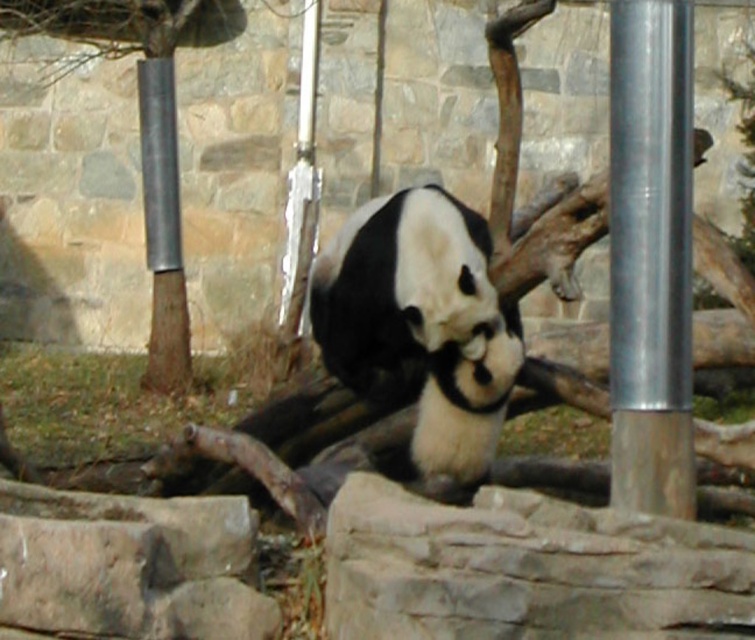
Question: Which point is closer to the camera?

Choices:
 (A) (302, 148)
 (B) (381, 321)

Answer: (B)

Question: Estimate the real-world distances between objects in this image. Which object is closer to the silver metallic pole at center?

Choices:
 (A) gray rough stone at center
 (B) metallic smooth pole at left

Answer: (B)

Question: Can you confirm if silver metallic pole at right is wider than silver metallic pole at center?

Choices:
 (A) no
 (B) yes

Answer: (B)

Question: Does silver metallic pole at right have a lesser width compared to silver metallic pole at center?

Choices:
 (A) no
 (B) yes

Answer: (A)

Question: Which point is farther to the camera?

Choices:
 (A) (624, 394)
 (B) (341, 339)
 (C) (176, 196)

Answer: (C)

Question: Is metallic smooth pole at left smaller than silver metallic pole at center?

Choices:
 (A) yes
 (B) no

Answer: (A)